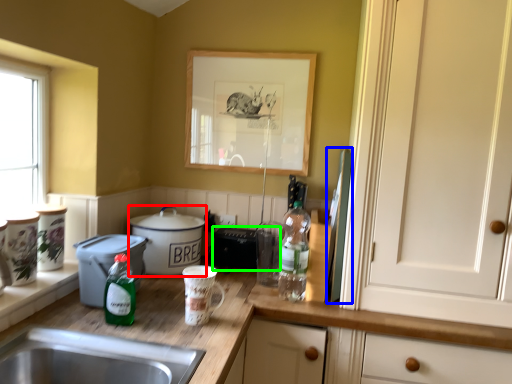
Question: Which object is positioned farthest from cooker (highlighted by a red box)? Select from appliance (highlighted by a blue box) and appliance (highlighted by a green box).

Choices:
 (A) appliance
 (B) appliance

Answer: (A)